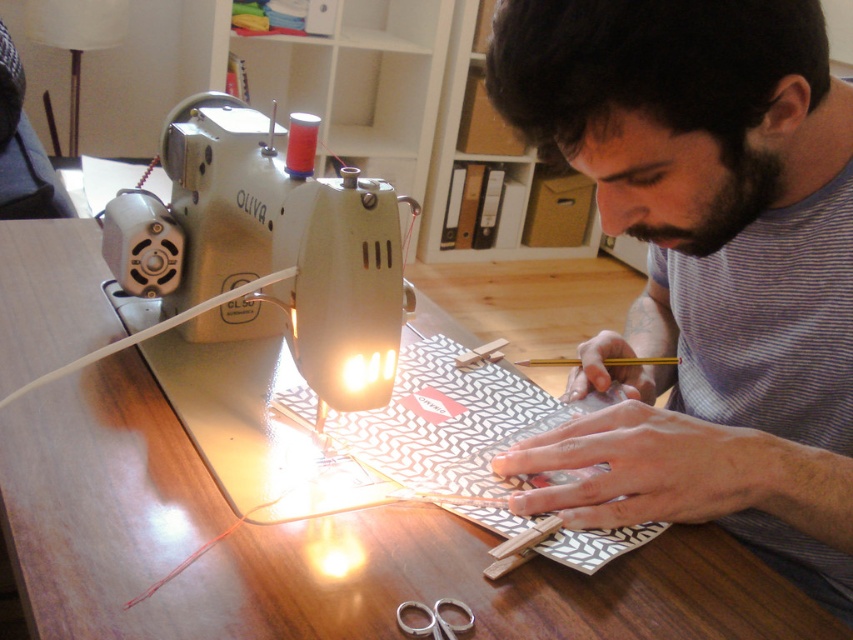
You have a rectangular box that is 1.2 meters long. You want to place it on the wooden table at center without overlapping the metallic silver sewing machine at center. Is the table long enough to accommodate the box?

The wooden table at center is wider than the metallic silver sewing machine at center. However, the question asks about the length of the table. Since the description only mentions the width of the table being larger than the sewing machine, there is no information provided about the table length. Therefore, it is impossible to determine if the table is long enough to fit the 1.2 meter box without overlapping the sewing machine.

You are a craftsperson who needs to place a 10 cm tall tool on the wooden table at center. Can the tool fit vertically on the table without touching the metallic silver sewing machine at center?

The wooden table at center is taller than metallic silver sewing machine at center. Since the sewing machine is shorter than the table, the 10 cm tall tool can be placed vertically on the wooden table at center without touching the sewing machine.